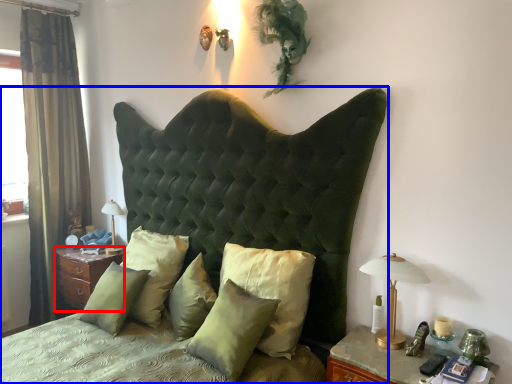
Question: Which point is further to the camera, nightstand (highlighted by a red box) or bed (highlighted by a blue box)?

Choices:
 (A) nightstand
 (B) bed

Answer: (A)